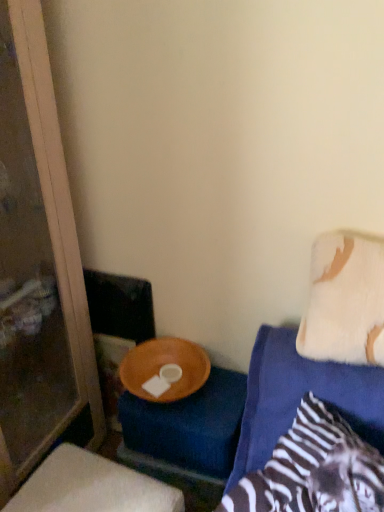
Question: Considering the positions of white fluffy pillow at upper right and transparent glass screen door at left in the image, is white fluffy pillow at upper right bigger or smaller than transparent glass screen door at left?

Choices:
 (A) small
 (B) big

Answer: (A)

Question: From the image's perspective, relative to transparent glass screen door at left, is white fluffy pillow at upper right above or below?

Choices:
 (A) above
 (B) below

Answer: (A)

Question: Considering the real-world distances, which object is farthest from the white fluffy pillow at upper right?

Choices:
 (A) wooden bowl at lower center
 (B) transparent glass screen door at left

Answer: (B)

Question: Estimate the real-world distances between objects in this image. Which object is farther from the wooden bowl at lower center?

Choices:
 (A) transparent glass screen door at left
 (B) white fluffy pillow at upper right

Answer: (B)